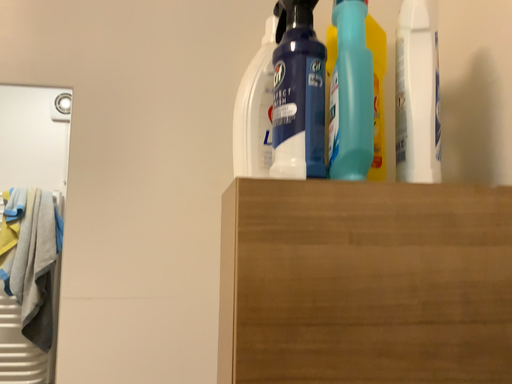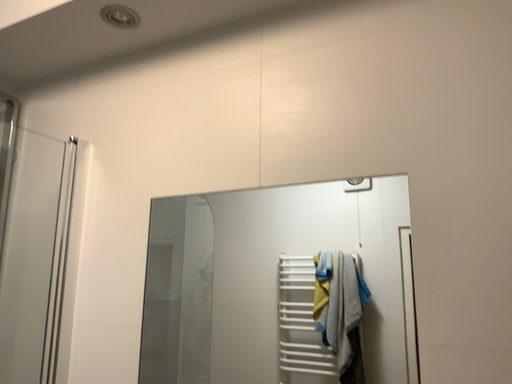
Question: How did the camera likely rotate when shooting the video?

Choices:
 (A) rotated upward
 (B) rotated downward

Answer: (A)